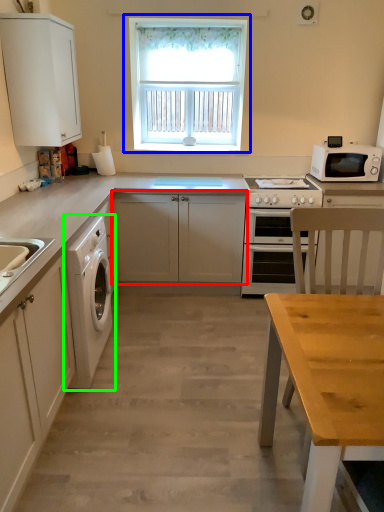
Question: Which is nearer to the cabinetry (highlighted by a red box)? window (highlighted by a blue box) or washing machine (highlighted by a green box).

Choices:
 (A) window
 (B) washing machine

Answer: (B)